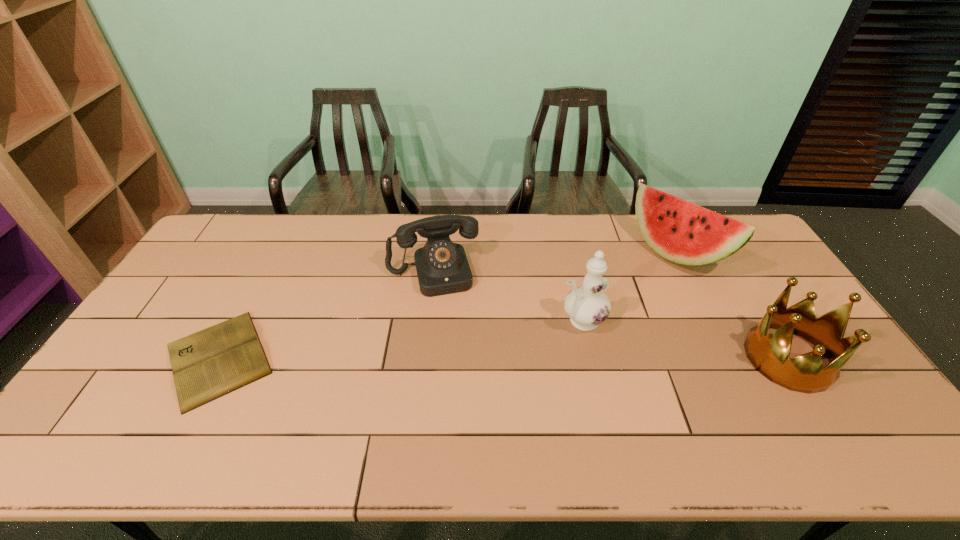
Locate an element on the screen. The image size is (960, 540). free space at the near edge is located at coordinates (663, 391).

Locate an element on the screen. The height and width of the screenshot is (540, 960). vacant space at the left edge of the desktop is located at coordinates (208, 292).

In the image, there is a desktop. Where is `vacant space at the right edge`? vacant space at the right edge is located at coordinates tap(778, 282).

Locate an element on the screen. Image resolution: width=960 pixels, height=540 pixels. vacant region at the far left corner is located at coordinates (233, 220).

The width and height of the screenshot is (960, 540). Find the location of `blank region between the crown and the shortest object`. blank region between the crown and the shortest object is located at coordinates (503, 358).

The image size is (960, 540). I want to click on free space between the watermelon and the telephone, so click(x=554, y=262).

The width and height of the screenshot is (960, 540). I want to click on free space between the telephone and the shortest object, so click(x=325, y=315).

Locate an element on the screen. This screenshot has width=960, height=540. free area in between the second object from left to right and the crown is located at coordinates (611, 315).

At what (x,y) coordinates should I click in order to perform the action: click on free space between the tallest object and the watermelon. Please return your answer as a coordinate pair (x, y). The image size is (960, 540). Looking at the image, I should click on click(629, 286).

You are a GUI agent. You are given a task and a screenshot of the screen. Output one action in this format:
    pyautogui.click(x=<x>, y=<y>)
    Task: Click on the vacant space that is in between the second shortest object and the tallest object
    This screenshot has width=960, height=540.
    Given the screenshot: What is the action you would take?
    pyautogui.click(x=507, y=296)